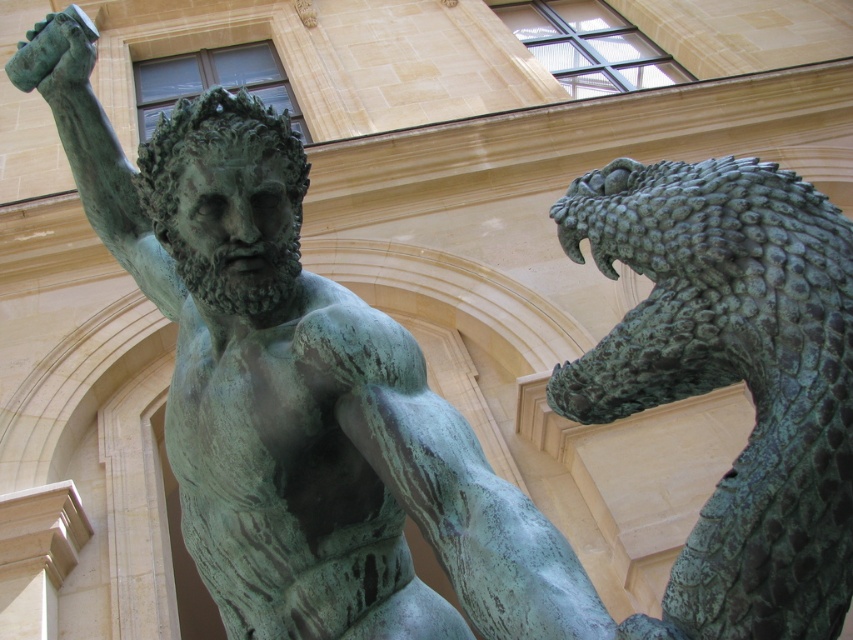
In the scene shown: You are standing in front of the bronze statue and want to touch the point at coordinates point (364, 552) and point (659, 168). Which point should you reach for first if you want to touch the one closer to you?

Point (659, 168) is closer to you than point (364, 552), so you should reach for point (659, 168) first.

What are the coordinates of the green patina statue at center?

The green patina statue at center is located at coordinates point (297, 394).